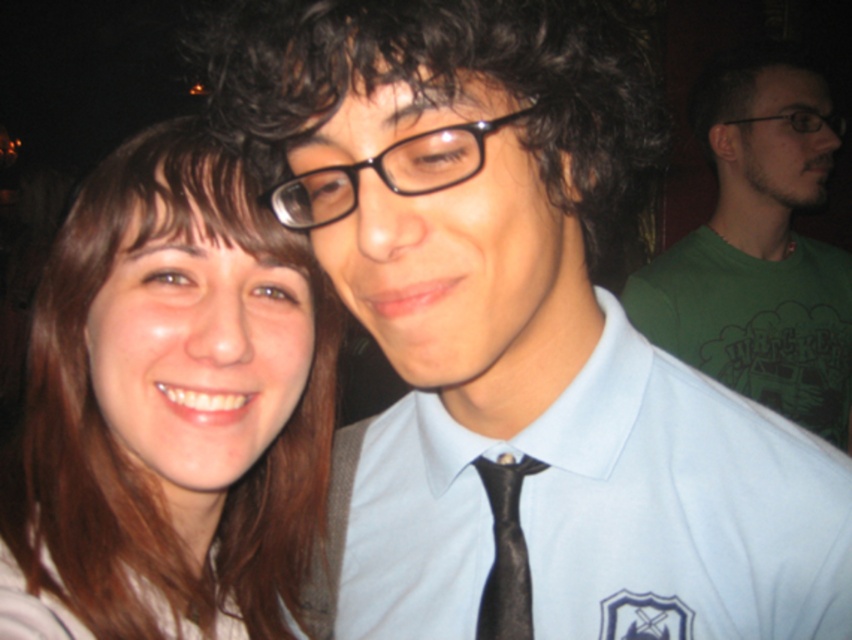
Is point (283, 170) farther from camera compared to point (792, 112)?

No, (283, 170) is closer to viewer.

Does point (445, 10) come in front of point (741, 122)?

Yes, point (445, 10) is in front of point (741, 122).

Locate an element on the screen. This screenshot has height=640, width=852. dark curly hair at center is located at coordinates (453, 88).

Is light blue smooth dress shirt at center below black plastic glasses at upper right?

Yes.

Is light blue smooth dress shirt at center shorter than black plastic glasses at upper right?

Incorrect, light blue smooth dress shirt at center's height does not fall short of black plastic glasses at upper right's.

Who is more forward, (458,579) or (809,120)?

Positioned in front is point (458,579).

Locate an element on the screen. This screenshot has height=640, width=852. light blue smooth dress shirt at center is located at coordinates (603, 513).

Does light blue smooth dress shirt at center appear under green cotton t-shirt at upper right?

Correct, light blue smooth dress shirt at center is located below green cotton t-shirt at upper right.

Which is above, light blue smooth dress shirt at center or green cotton t-shirt at upper right?

green cotton t-shirt at upper right is higher up.

Measure the distance between light blue smooth dress shirt at center and camera.

21.90 inches

Locate an element on the screen. The height and width of the screenshot is (640, 852). light blue smooth dress shirt at center is located at coordinates (603, 513).